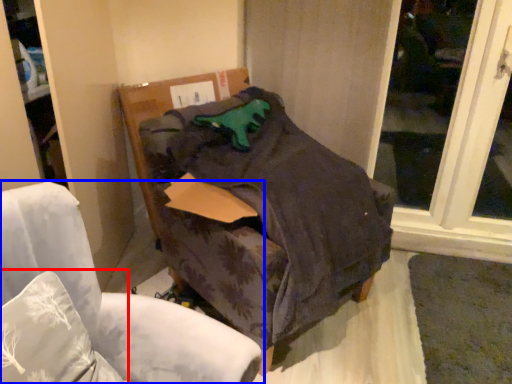
Question: Which object appears closest to the camera in this image, pillow (highlighted by a red box) or chair (highlighted by a blue box)?

Choices:
 (A) pillow
 (B) chair

Answer: (B)